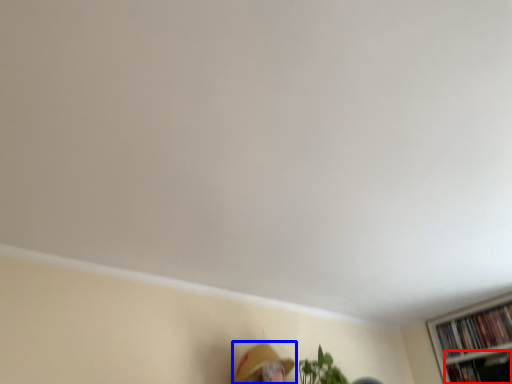
Question: Which of the following is the closest to the observer, book (highlighted by a red box) or person (highlighted by a blue box)?

Choices:
 (A) book
 (B) person

Answer: (B)